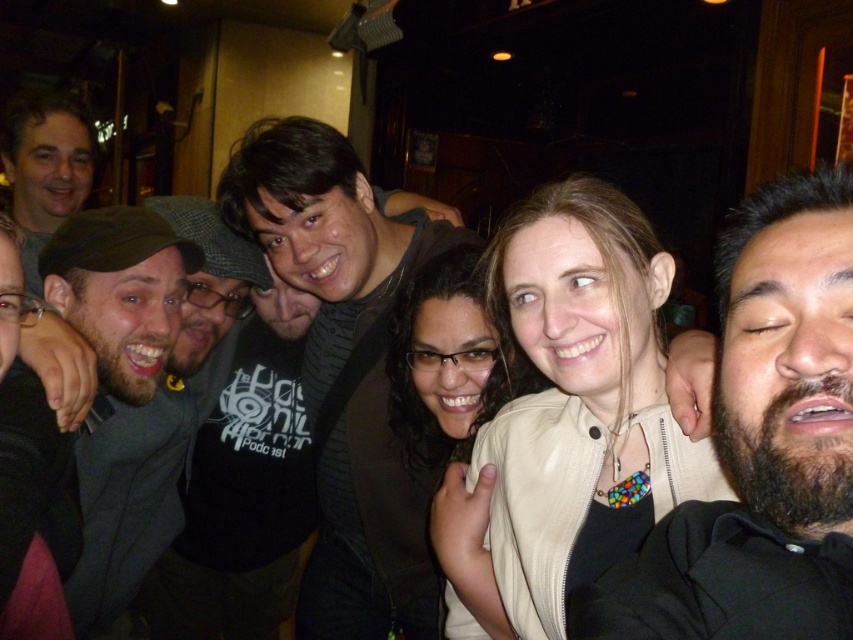
You are organizing a photo shoot and need to arrange two items from the scene for a closeup. The items are the light beige leather jacket at center and the dark gray sweater at center. Which item should you choose if you want the one that takes up less space in the frame?

The light beige leather jacket at center has a smaller size compared to the dark gray sweater at center, so it takes up less space in the frame.

You are standing in front of the group of six people at the bar. You want to take a photo of the two points marked in the image. Which point, point 1 at coordinates (747, 499) or point 2 at coordinates (224, 182), is closer to you?

Point 1 at coordinates (747, 499) is closer to you because it is closer to the camera than point 2 at coordinates (224, 182).

You are organizing a charity event and need to decide which of the two outfits, the dark gray sweater at center or the dark green fabric shirt at left, can accommodate a larger embroidered patch. Based on the image, which one would you choose?

The dark gray sweater at center is bigger than the dark green fabric shirt at left, so the dark gray sweater at center can accommodate a larger embroidered patch.